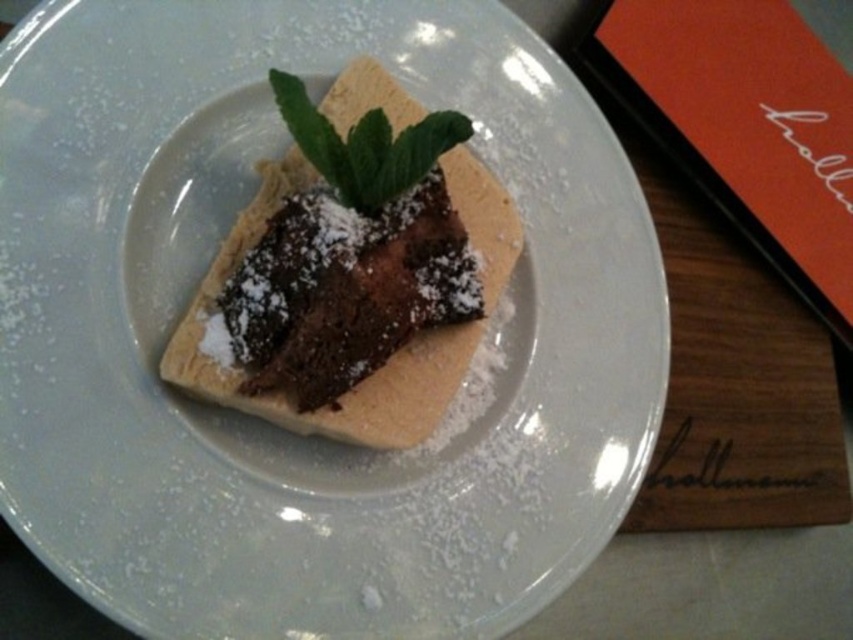
Question: Among these objects, which one is nearest to the camera?

Choices:
 (A) chocolate matte brownie at center
 (B) green leafy mint at center

Answer: (B)

Question: Can you confirm if chocolate matte brownie at center is positioned below green leafy mint at center?

Choices:
 (A) yes
 (B) no

Answer: (A)

Question: Which point is closer to the camera?

Choices:
 (A) green leafy mint at center
 (B) chocolate matte brownie at center

Answer: (A)

Question: Where is chocolate matte brownie at center located in relation to green leafy mint at center in the image?

Choices:
 (A) below
 (B) above

Answer: (A)

Question: Does chocolate matte brownie at center appear on the right side of green leafy mint at center?

Choices:
 (A) yes
 (B) no

Answer: (B)